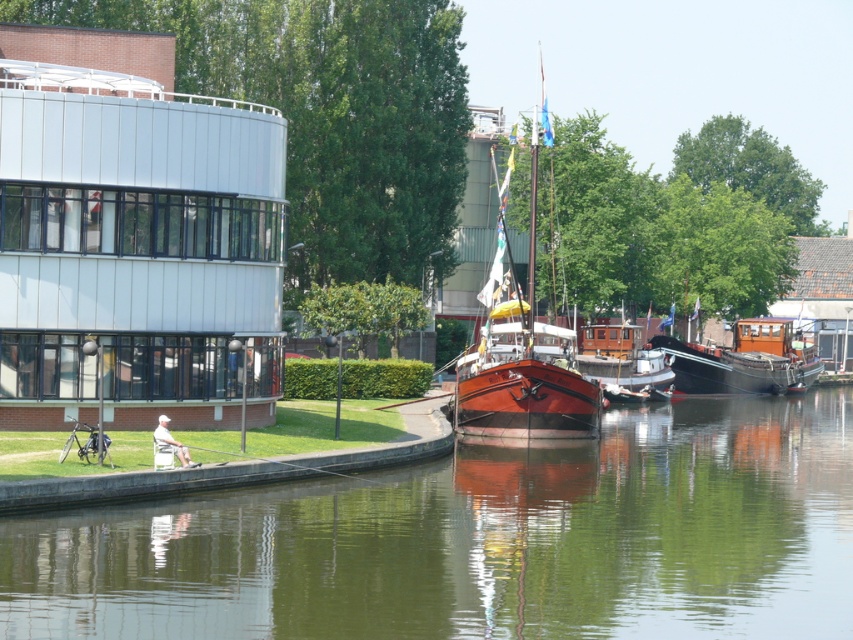
You are standing at the riverside and want to take a photo of the wooden polished boat at right and the white fabric at lower left. Which object should you focus on first if you want to capture both in the same frame without moving the camera?

The wooden polished boat at right is above the white fabric at lower left, so you should focus on the white fabric at lower left first to ensure both are in the frame without moving the camera.

You are standing at the riverside and looking at the scene. There are two points marked in the image. Based on their positions, which point is closer to you, point (743, 387) or point (172, 438)?

Point (172, 438) is closer to you because the description states that point (743, 387) is further away from the camera than point (172, 438).

You are standing at the point labeled point [498,240] and want to walk to the point labeled point [732,364]. According to the scene description, will you be moving towards the building or away from it?

According to the scene description, point [498,240] is in front of point [732,364]. Since the building is located on the left side of the frame, moving from a point in front to the one behind would mean moving away from the building towards the river. Therefore, you would be moving away from the building.